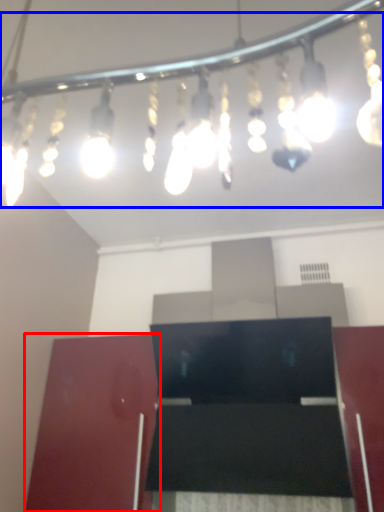
Question: Which object appears closest to the camera in this image, furniture (highlighted by a red box) or lamp (highlighted by a blue box)?

Choices:
 (A) furniture
 (B) lamp

Answer: (B)